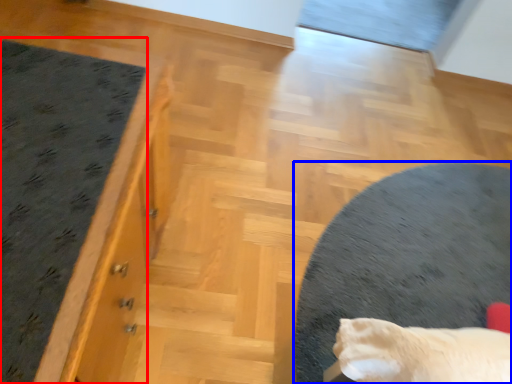
Question: Which object appears closest to the camera in this image, mat (highlighted by a red box) or furniture (highlighted by a blue box)?

Choices:
 (A) mat
 (B) furniture

Answer: (A)